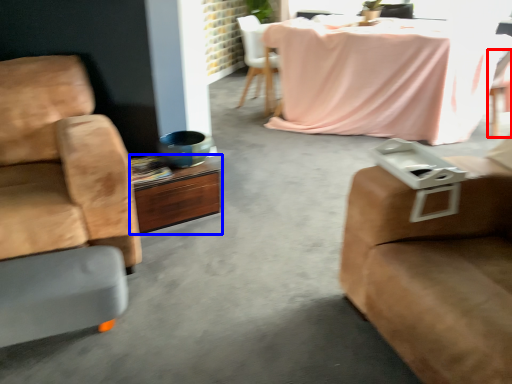
Question: Among these objects, which one is nearest to the camera, chair (highlighted by a red box) or desk (highlighted by a blue box)?

Choices:
 (A) chair
 (B) desk

Answer: (B)